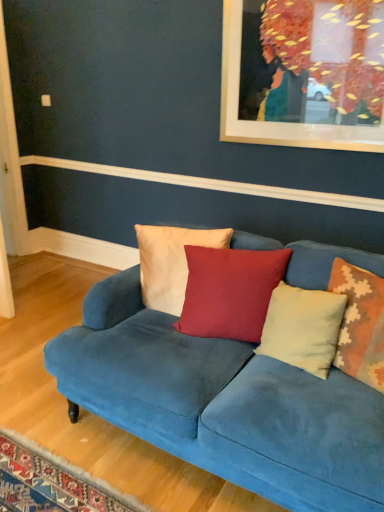
Question: Is beige textured pillow at right, which is the fourth pillow in left-to-right order, to the right of white cotton pillow at center, placed as the 1th pillow when sorted from left to right, from the viewer's perspective?

Choices:
 (A) no
 (B) yes

Answer: (B)

Question: Would you say beige textured pillow at right, which is the fourth pillow in left-to-right order, is outside white cotton pillow at center, the fourth pillow viewed from the right?

Choices:
 (A) no
 (B) yes

Answer: (B)

Question: Is beige textured pillow at right, which is counted as the 1th pillow, starting from the right, next to white cotton pillow at center, the fourth pillow viewed from the right?

Choices:
 (A) yes
 (B) no

Answer: (B)

Question: Is beige textured pillow at right, which is the fourth pillow in left-to-right order, aimed at white cotton pillow at center, placed as the 1th pillow when sorted from left to right?

Choices:
 (A) yes
 (B) no

Answer: (B)

Question: Is beige textured pillow at right, which is the fourth pillow in left-to-right order, bigger than white cotton pillow at center, the fourth pillow viewed from the right?

Choices:
 (A) no
 (B) yes

Answer: (A)

Question: From the image's perspective, is beige textured pillow at right, which is counted as the 1th pillow, starting from the right, beneath white cotton pillow at center, the fourth pillow viewed from the right?

Choices:
 (A) yes
 (B) no

Answer: (A)

Question: Is white cotton pillow at center, placed as the 1th pillow when sorted from left to right, completely or partially inside light beige velvet pillow at center, positioned as the second pillow in right-to-left order?

Choices:
 (A) no
 (B) yes

Answer: (A)

Question: Does light beige velvet pillow at center, positioned as the second pillow in right-to-left order, come in front of white cotton pillow at center, the fourth pillow viewed from the right?

Choices:
 (A) yes
 (B) no

Answer: (A)

Question: Does light beige velvet pillow at center, positioned as the second pillow in right-to-left order, have a greater height compared to white cotton pillow at center, the fourth pillow viewed from the right?

Choices:
 (A) yes
 (B) no

Answer: (B)

Question: Can you confirm if light beige velvet pillow at center, positioned as the second pillow in right-to-left order, is bigger than white cotton pillow at center, the fourth pillow viewed from the right?

Choices:
 (A) no
 (B) yes

Answer: (A)

Question: Is light beige velvet pillow at center, which ranks as the third pillow in left-to-right order, positioned with its back to white cotton pillow at center, the fourth pillow viewed from the right?

Choices:
 (A) yes
 (B) no

Answer: (B)

Question: Considering the relative sizes of light beige velvet pillow at center, positioned as the second pillow in right-to-left order, and white cotton pillow at center, the fourth pillow viewed from the right, in the image provided, is light beige velvet pillow at center, positioned as the second pillow in right-to-left order, wider than white cotton pillow at center, the fourth pillow viewed from the right,?

Choices:
 (A) no
 (B) yes

Answer: (B)

Question: Does beige textured pillow at right, which is the fourth pillow in left-to-right order, contain matte red cushion at center, the 3th pillow from the right?

Choices:
 (A) yes
 (B) no

Answer: (B)